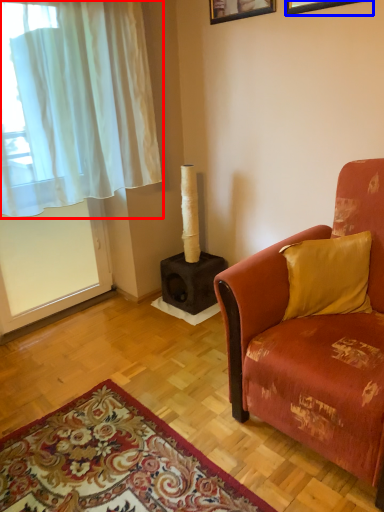
Question: Which object appears closest to the camera in this image, curtain (highlighted by a red box) or picture frame (highlighted by a blue box)?

Choices:
 (A) curtain
 (B) picture frame

Answer: (A)